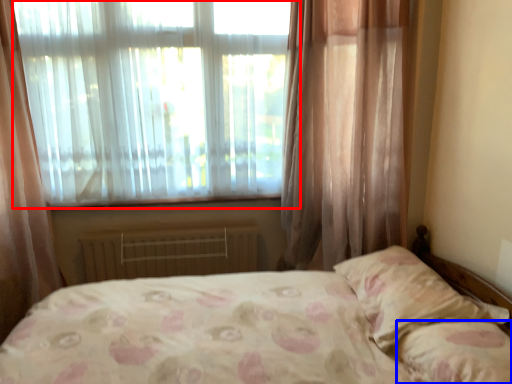
Question: Which object is closer to the camera taking this photo, window (highlighted by a red box) or pillow (highlighted by a blue box)?

Choices:
 (A) window
 (B) pillow

Answer: (B)